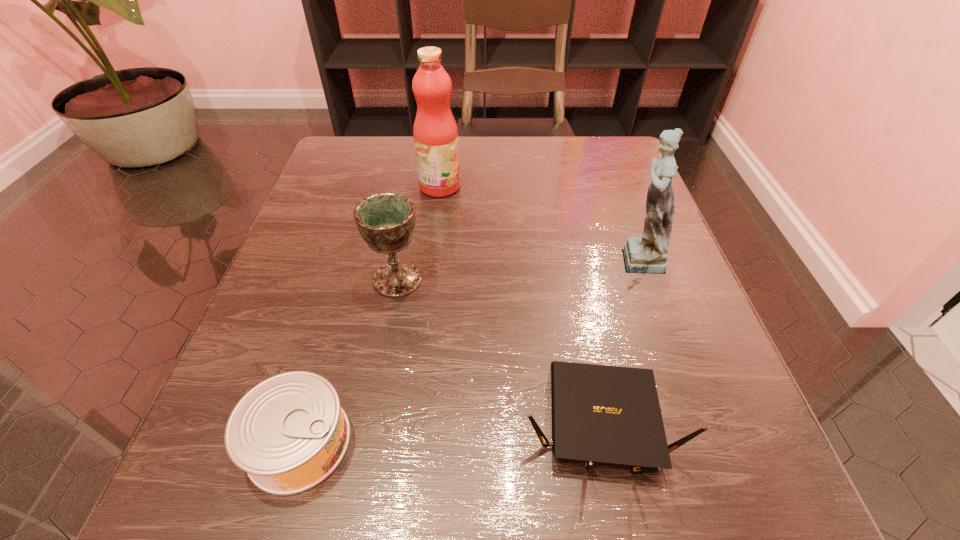
This screenshot has width=960, height=540. Find the location of `free point that satisfies the following two spatial constraints: 1. on the front-facing side of the figurine; 2. on the front side of the can`. free point that satisfies the following two spatial constraints: 1. on the front-facing side of the figurine; 2. on the front side of the can is located at coordinates (702, 442).